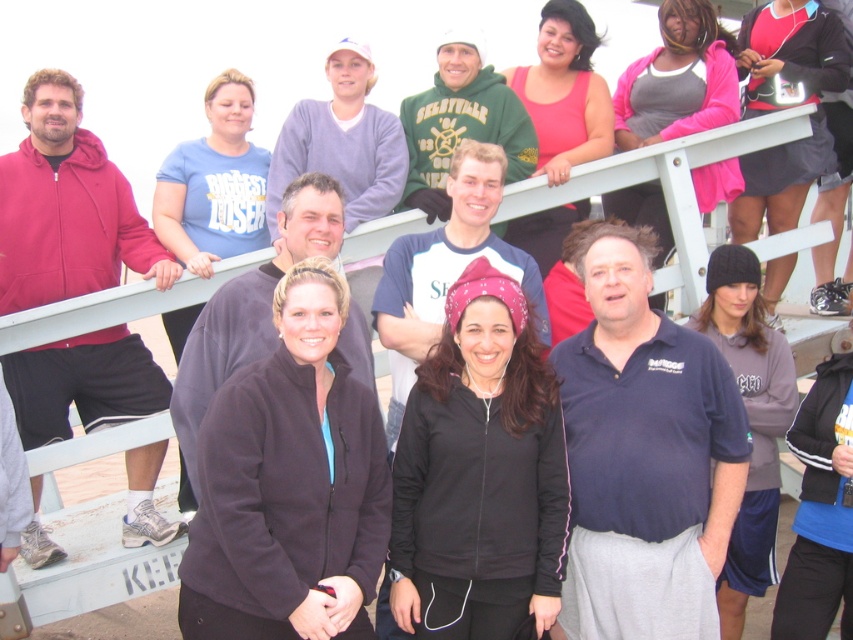
You are a photographer trying to capture a candid shot of the dark blue polo shirt at center and the dark gray fleece jacket at center. Since you want to focus on their faces, which clothing item should you adjust your camera angle to avoid blocking the view?

The dark blue polo shirt at center is shorter than the dark gray fleece jacket at center, so you should adjust your camera angle to avoid the dark gray fleece jacket at center, which is taller and might block the view of the faces.

You are organizing a photo shoot and need to arrange two models wearing the dark blue polo shirt at center and the dark gray fleece jacket at center. Based on the scene description, which model should stand on the left to mirror the original image?

The dark gray fleece jacket at center should stand on the left because in the original image, the dark blue polo shirt at center is positioned on the right side of the dark gray fleece jacket at center.

You are organizing a clothing donation drive and need to determine if the dark blue polo shirt at center can fit inside the dark gray fleece jacket at center. Based on the sizes provided, can the polo shirt fit inside the jacket?

The dark blue polo shirt at center is smaller than the dark gray fleece jacket at center, so it can fit inside the jacket.